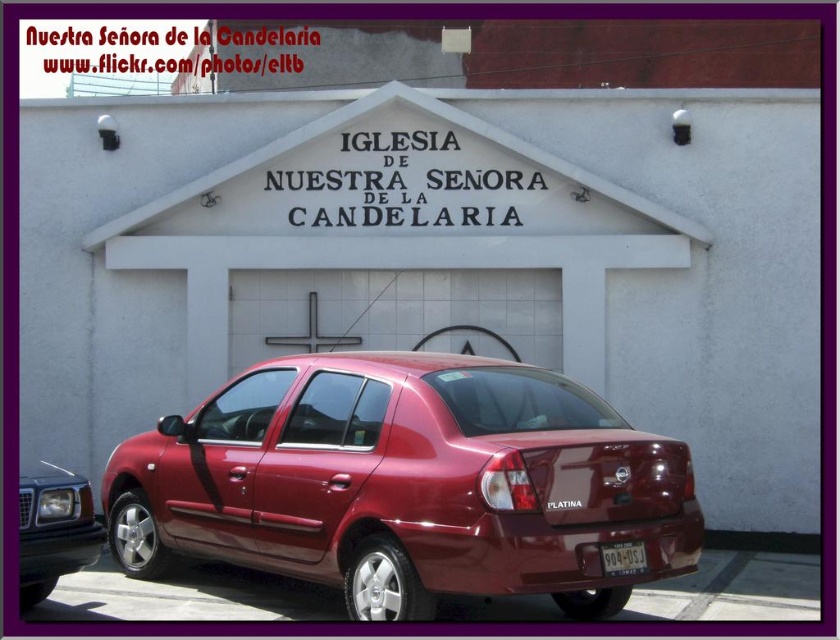
Which is more to the left, satin burgundy sedan at lower center or satin burgundy sedan at lower left?

satin burgundy sedan at lower left

Can you confirm if satin burgundy sedan at lower center is positioned to the right of satin burgundy sedan at lower left?

Indeed, satin burgundy sedan at lower center is positioned on the right side of satin burgundy sedan at lower left.

Which is in front, point (549, 566) or point (25, 486)?

Point (549, 566) is more forward.

Locate an element on the screen. The height and width of the screenshot is (640, 840). satin burgundy sedan at lower center is located at coordinates (407, 483).

Between satin burgundy sedan at lower left and yellowish matte license plate at center, which one is positioned lower?

satin burgundy sedan at lower left

Does satin burgundy sedan at lower left have a greater width compared to yellowish matte license plate at center?

Yes, satin burgundy sedan at lower left is wider than yellowish matte license plate at center.

Is point (72, 513) more distant than point (644, 560)?

Yes, point (72, 513) is behind point (644, 560).

This screenshot has height=640, width=840. I want to click on satin burgundy sedan at lower left, so click(53, 529).

Is satin burgundy sedan at lower center below yellowish matte license plate at center?

No.

Is satin burgundy sedan at lower center to the right of yellowish matte license plate at center from the viewer's perspective?

Incorrect, satin burgundy sedan at lower center is not on the right side of yellowish matte license plate at center.

This screenshot has width=840, height=640. I want to click on satin burgundy sedan at lower center, so click(407, 483).

At what (x,y) coordinates should I click in order to perform the action: click on satin burgundy sedan at lower center. Please return your answer as a coordinate pair (x, y). Looking at the image, I should click on (407, 483).